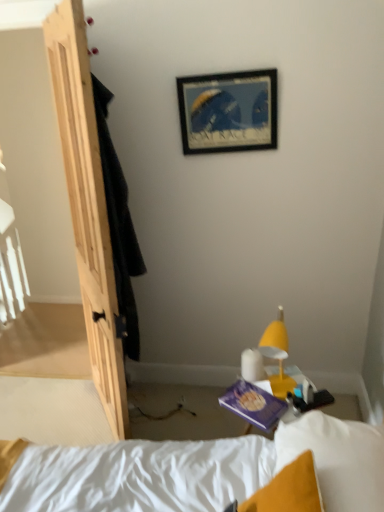
Question: From a real-world perspective, is wooden picture frame at upper center over yellow matte lamp at lower right?

Choices:
 (A) no
 (B) yes

Answer: (B)

Question: Is wooden picture frame at upper center positioned beyond the bounds of yellow matte lamp at lower right?

Choices:
 (A) yes
 (B) no

Answer: (A)

Question: Does wooden picture frame at upper center appear on the right side of yellow matte lamp at lower right?

Choices:
 (A) yes
 (B) no

Answer: (B)

Question: Could you tell me if wooden picture frame at upper center is turned towards yellow matte lamp at lower right?

Choices:
 (A) no
 (B) yes

Answer: (A)

Question: Is the position of wooden picture frame at upper center more distant than that of yellow matte lamp at lower right?

Choices:
 (A) yes
 (B) no

Answer: (A)

Question: Does wooden picture frame at upper center have a larger size compared to yellow matte lamp at lower right?

Choices:
 (A) yes
 (B) no

Answer: (B)

Question: Can you confirm if wooden picture frame at upper center is wider than purple matte paperback book at lower center?

Choices:
 (A) yes
 (B) no

Answer: (B)

Question: Is wooden picture frame at upper center located outside purple matte paperback book at lower center?

Choices:
 (A) yes
 (B) no

Answer: (A)

Question: From the image's perspective, would you say wooden picture frame at upper center is shown under purple matte paperback book at lower center?

Choices:
 (A) yes
 (B) no

Answer: (B)

Question: Is wooden picture frame at upper center oriented towards purple matte paperback book at lower center?

Choices:
 (A) no
 (B) yes

Answer: (A)

Question: From a real-world perspective, does wooden picture frame at upper center sit lower than purple matte paperback book at lower center?

Choices:
 (A) yes
 (B) no

Answer: (B)

Question: From the image's perspective, is wooden picture frame at upper center on top of purple matte paperback book at lower center?

Choices:
 (A) yes
 (B) no

Answer: (A)

Question: From a real-world perspective, does natural wood door at left stand above yellow matte lamp at lower right?

Choices:
 (A) no
 (B) yes

Answer: (B)